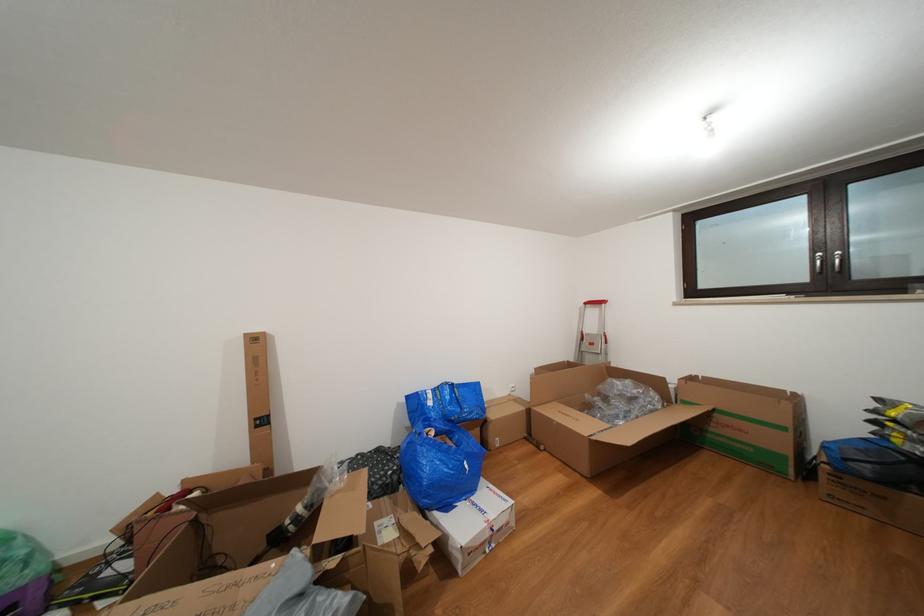
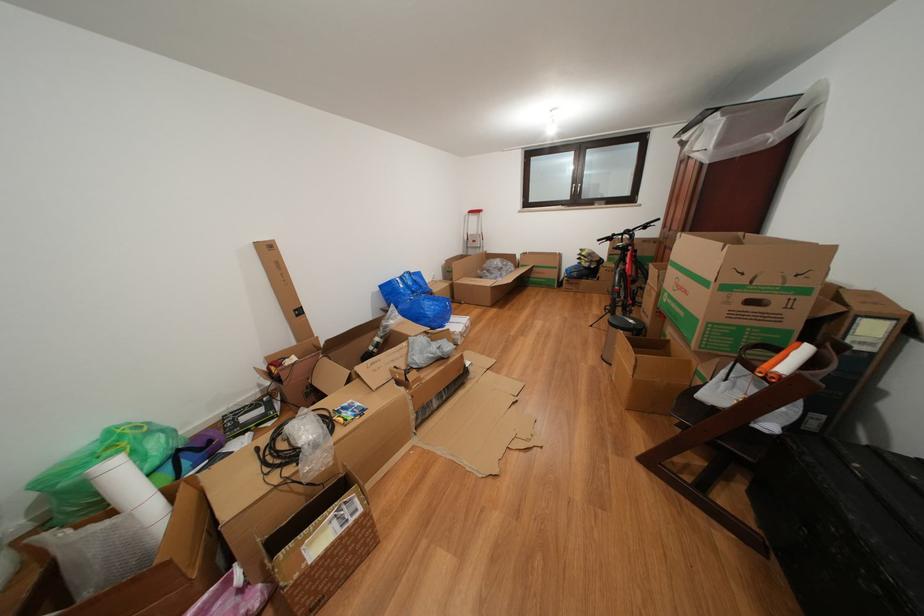
Locate, in the second image, the point that corresponds to point (439, 408) in the first image.

(409, 291)